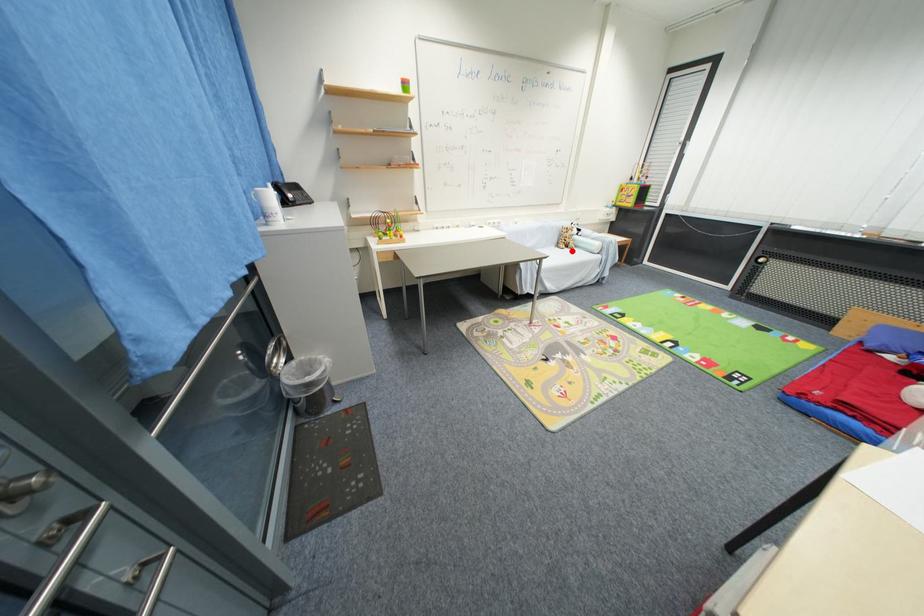
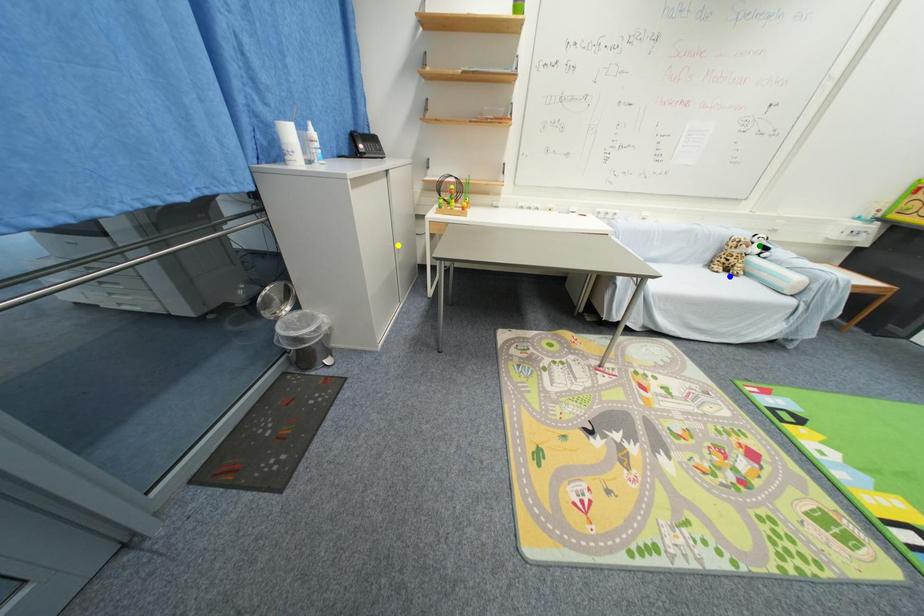
Question: I am providing you with two images of the same scene from different viewpoints. A red point is marked on the first image. You are given multiple points on the second image. Which point in image 2 represents the same 3d spot as the red point in image 1?

Choices:
 (A) yellow point
 (B) green point
 (C) blue point

Answer: (C)